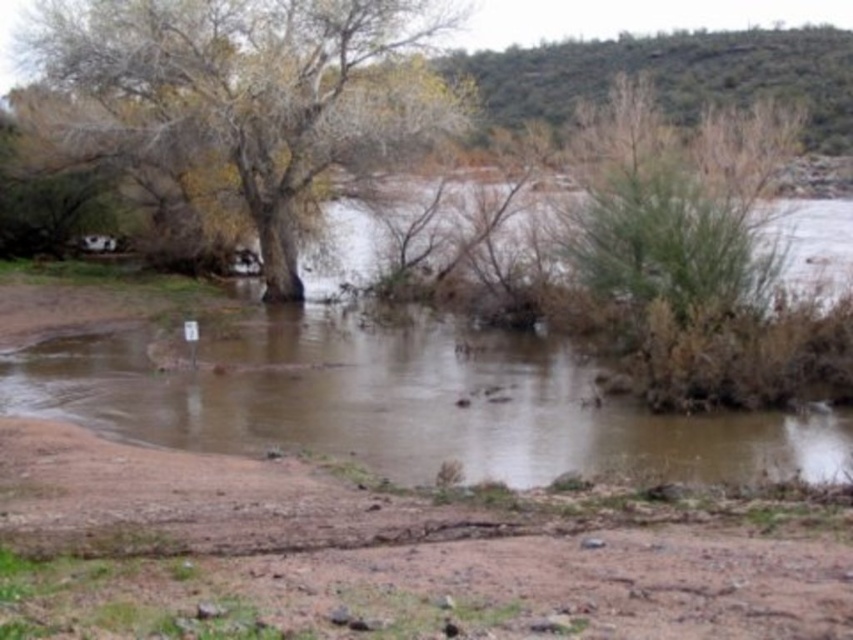
This screenshot has height=640, width=853. What do you see at coordinates (252, 93) in the screenshot?
I see `brown rough tree at upper left` at bounding box center [252, 93].

Is brown rough tree at upper left wider than green leafy bush at upper right?

Yes, brown rough tree at upper left is wider than green leafy bush at upper right.

Measure the distance between point (172, 76) and camera.

Point (172, 76) is 33.21 meters from camera.

You are a GUI agent. You are given a task and a screenshot of the screen. Output one action in this format:
    pyautogui.click(x=<x>, y=<y>)
    Task: Click on the brown rough tree at upper left
    Image resolution: width=853 pixels, height=640 pixels.
    Given the screenshot: What is the action you would take?
    pyautogui.click(x=252, y=93)

Is brown muddy water at center thinner than brown rough tree at upper left?

Incorrect, brown muddy water at center's width is not less than brown rough tree at upper left's.

Based on the photo, is brown muddy water at center smaller than brown rough tree at upper left?

Yes, brown muddy water at center is smaller than brown rough tree at upper left.

This screenshot has width=853, height=640. Describe the element at coordinates (404, 403) in the screenshot. I see `brown muddy water at center` at that location.

Image resolution: width=853 pixels, height=640 pixels. Identify the location of brown muddy water at center. (404, 403).

Find the location of a particular element. The image size is (853, 640). brown muddy water at center is located at coordinates (404, 403).